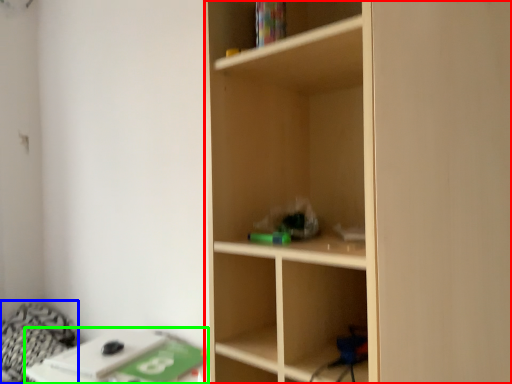
Question: Based on their relative distances, which object is nearer to shelf (highlighted by a red box)? Choose from bedding (highlighted by a blue box) and table (highlighted by a green box).

Choices:
 (A) bedding
 (B) table

Answer: (B)